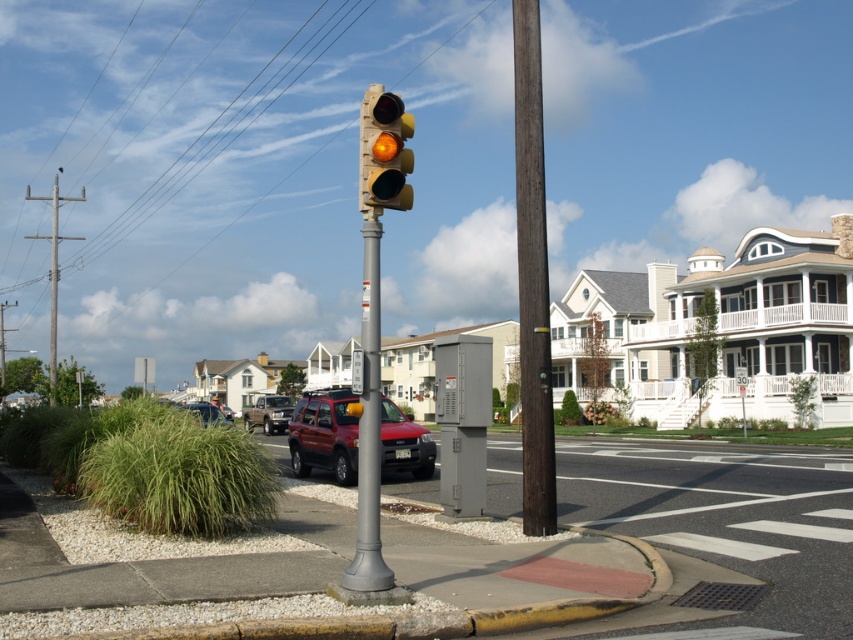
Does point (318, 412) come farther from viewer compared to point (194, 413)?

Yes, point (318, 412) is behind point (194, 413).

Who is positioned more to the right, shiny red suv at center or metallic silver suv at center-left?

From the viewer's perspective, shiny red suv at center appears more on the right side.

This screenshot has width=853, height=640. Describe the element at coordinates (325, 435) in the screenshot. I see `shiny red suv at center` at that location.

Locate an element on the screen. The width and height of the screenshot is (853, 640). shiny red suv at center is located at coordinates (325, 435).

Does brown wooden pole at center have a lesser height compared to metallic rectangular sign at center?

In fact, brown wooden pole at center may be taller than metallic rectangular sign at center.

Who is taller, brown wooden pole at center or metallic rectangular sign at center?

brown wooden pole at center is taller.

Image resolution: width=853 pixels, height=640 pixels. I want to click on brown wooden pole at center, so click(532, 276).

Is matte yellow traffic light at center bigger than matte brown suv at center?

No.

Can you confirm if matte yellow traffic light at center is positioned below matte brown suv at center?

Incorrect, matte yellow traffic light at center is not positioned below matte brown suv at center.

Who is more distant from viewer, (392,100) or (282,416)?

Positioned behind is point (282,416).

Identify the location of matte yellow traffic light at center. This screenshot has height=640, width=853. click(384, 150).